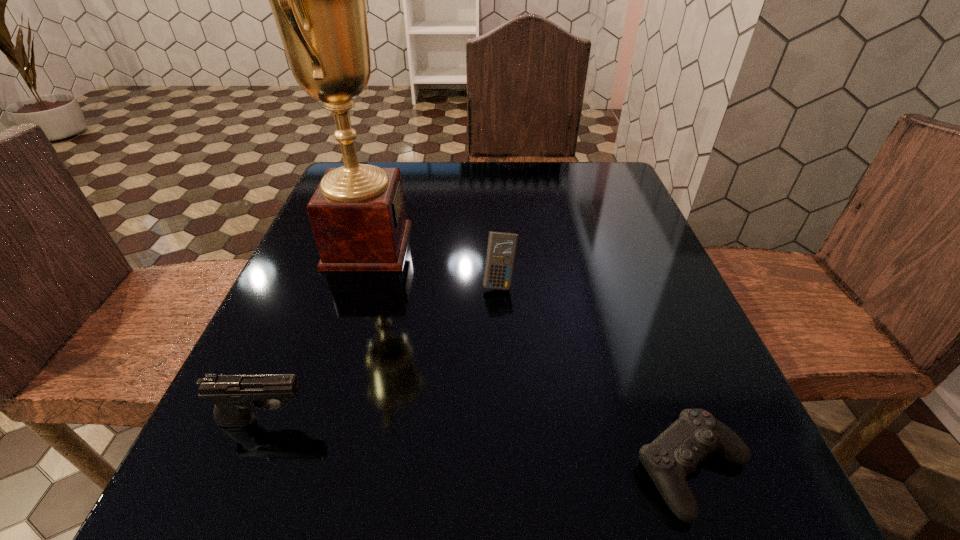
Identify the location of trophy cup. (357, 213).

At what (x,y) coordinates should I click in order to perform the action: click on the second object from right to left. Please return your answer as a coordinate pair (x, y). This screenshot has height=540, width=960. Looking at the image, I should click on (501, 249).

Find the location of `pistol`. pistol is located at coordinates (234, 396).

Find the location of a particular element. The height and width of the screenshot is (540, 960). the shortest object is located at coordinates (675, 453).

Image resolution: width=960 pixels, height=540 pixels. Find the location of `the rightmost object`. the rightmost object is located at coordinates (675, 453).

Image resolution: width=960 pixels, height=540 pixels. I want to click on vacant area situated 0.230m on the plaque of the trophy cup, so click(x=516, y=246).

Identify the location of blank area located 0.100m on the front-facing side of the calculator. The width and height of the screenshot is (960, 540). (502, 335).

At what (x,y) coordinates should I click in order to perform the action: click on free spot located at the barrel of the pistol. Please return your answer as a coordinate pair (x, y). The image size is (960, 540). Looking at the image, I should click on (404, 420).

Where is `free space located 0.180m on the back of the shortest object`? The image size is (960, 540). free space located 0.180m on the back of the shortest object is located at coordinates (640, 327).

The width and height of the screenshot is (960, 540). Identify the location of object that is at the near edge. (675, 453).